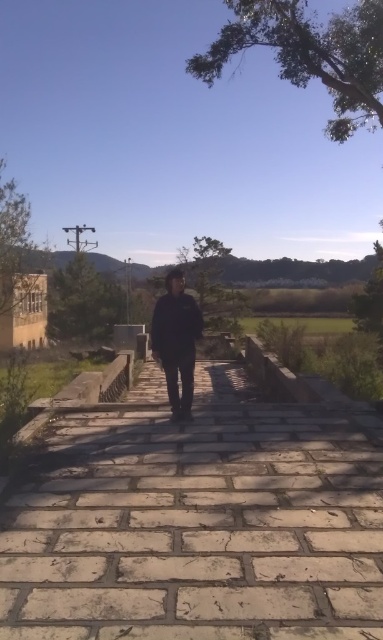
Question: Is light beige stone pavement at center to the left of black matte jacket at center from the viewer's perspective?

Choices:
 (A) yes
 (B) no

Answer: (B)

Question: Is light beige stone pavement at center above black matte jacket at center?

Choices:
 (A) yes
 (B) no

Answer: (B)

Question: Which object is farther from the camera taking this photo?

Choices:
 (A) black matte jacket at center
 (B) light beige stone pavement at center

Answer: (A)

Question: Where is light beige stone pavement at center located in relation to black matte jacket at center in the image?

Choices:
 (A) above
 (B) below

Answer: (B)

Question: Among these objects, which one is farthest from the camera?

Choices:
 (A) light beige stone pavement at center
 (B) black matte jacket at center

Answer: (B)